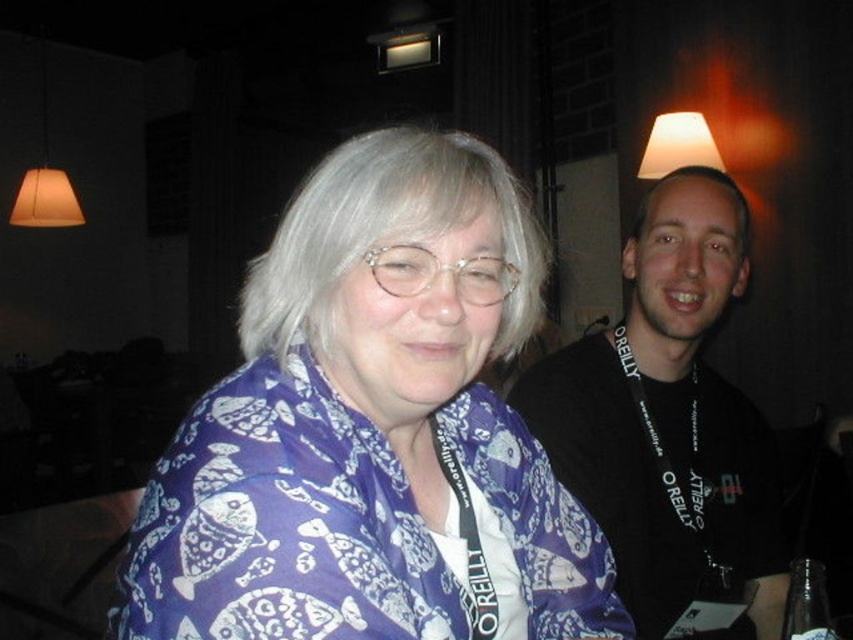
Consider the image. You are at an event and want to take a photo of the purple printed scarf at center. However, there is a matte white lampshade at upper center casting a shadow. Where should you position yourself to avoid the shadow?

The purple printed scarf at center is positioned under the matte white lampshade at upper center, so positioning yourself to the side of the lampshade would avoid the shadow cast by it.

You are standing at a social event and want to take a photo of the point at coordinates (473, 253). If your camera can focus on objects within 25 inches, will it be able to capture the point clearly?

The distance between the point at coordinates (473, 253) and the viewer is 24.22 inches, which is within the camera focus range of 25 inches. Therefore, the camera can capture the point clearly.

You are at an event and need to hang a small decoration that requires 15 cm of space. You have two options to place it either next to the black lanyard at right or the matte orange lampshade at upper left. Which location has enough vertical space?

The black lanyard at right has a greater height compared to the matte orange lampshade at upper left, so placing the decoration next to the black lanyard at right would provide sufficient vertical space for the 15 cm requirement.